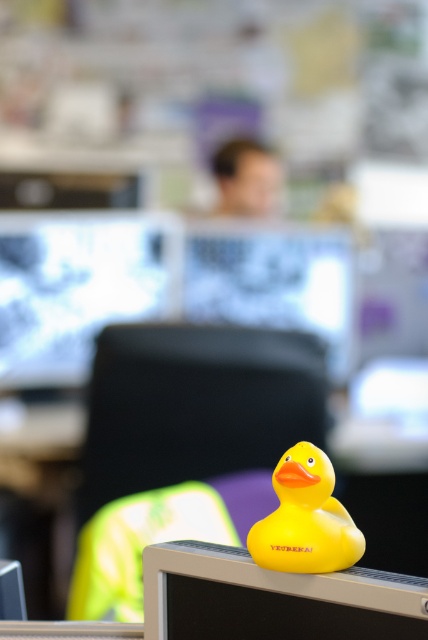
You are organizing a desk and need to place the yellow rubber duck at center so it can be seen clearly from the front. The matte black monitor at center is in the way. Can you move the duck to the front without moving the monitor?

The yellow rubber duck at center is currently behind the matte black monitor at center, so moving it to the front would require placing it in front of the monitor without moving it, which is possible by positioning the duck on the desk in front of the monitor.